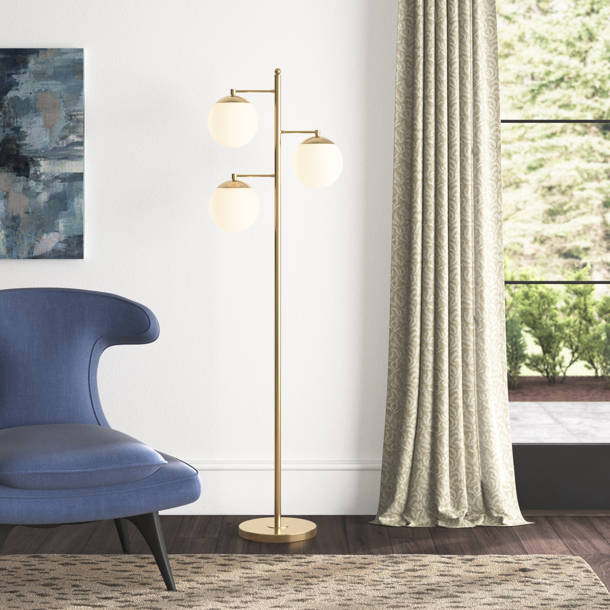
Locate an element on the screen. This screenshot has width=610, height=610. white baseboard is located at coordinates (335, 493).